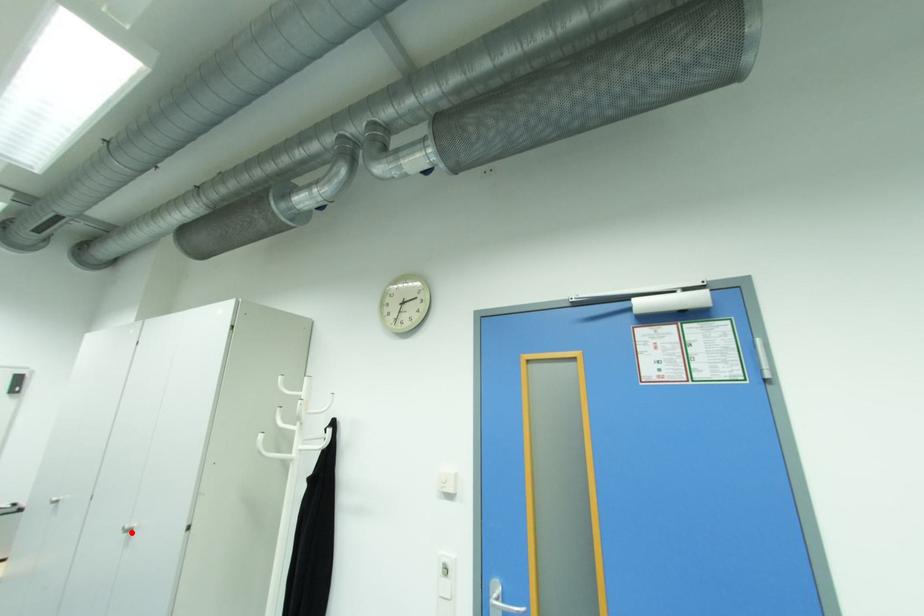
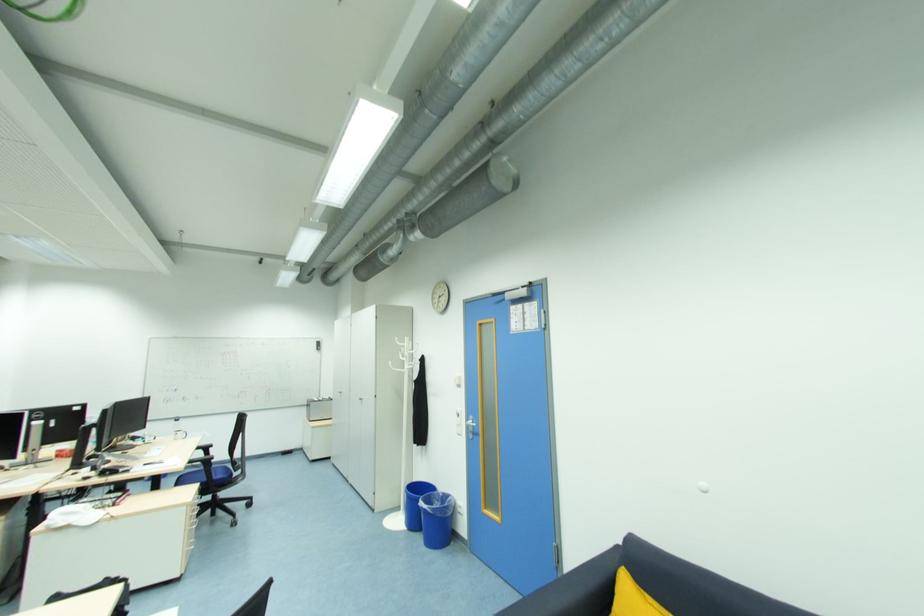
Locate, in the second image, the point that corresponds to the highlighted location in the first image.

(363, 400)